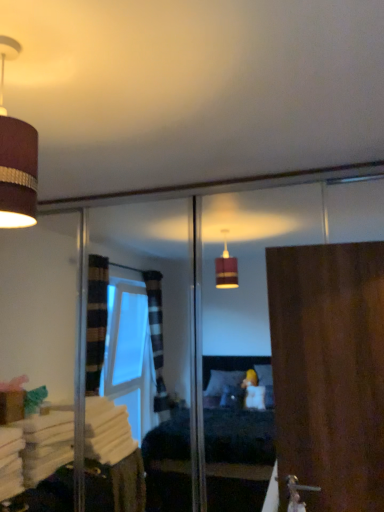
What do you see at coordinates (16, 158) in the screenshot? I see `matte brown lampshade at upper left` at bounding box center [16, 158].

Locate an element on the screen. matte brown lampshade at upper left is located at coordinates tap(16, 158).

What do you see at coordinates (329, 372) in the screenshot? I see `wooden door at right` at bounding box center [329, 372].

This screenshot has width=384, height=512. Find the location of `wooden door at right`. wooden door at right is located at coordinates (329, 372).

The width and height of the screenshot is (384, 512). Find the location of `matte brown lampshade at upper left`. matte brown lampshade at upper left is located at coordinates (16, 158).

Which object is positioned more to the left, matte brown lampshade at upper left or wooden door at right?

matte brown lampshade at upper left is more to the left.

Is matte brown lampshade at upper left in front of or behind wooden door at right in the image?

matte brown lampshade at upper left is positioned closer to the viewer than wooden door at right.

From the picture: Which point is more distant from viewer, (2, 164) or (373, 446)?

The point (373, 446) is farther.

From the image's perspective, between matte brown lampshade at upper left and wooden door at right, who is located below?

wooden door at right appears lower in the image.

From a real-world perspective, is matte brown lampshade at upper left physically located above or below wooden door at right?

In terms of real-world spatial position, matte brown lampshade at upper left is above wooden door at right.

Can you confirm if matte brown lampshade at upper left is thinner than wooden door at right?

No.

Is matte brown lampshade at upper left taller or shorter than wooden door at right?

In the image, matte brown lampshade at upper left appears to be shorter than wooden door at right.

Can you confirm if matte brown lampshade at upper left is smaller than wooden door at right?

Yes.

Based on the photo, is wooden door at right inside matte brown lampshade at upper left?

That's incorrect, wooden door at right is not inside matte brown lampshade at upper left.

Is matte brown lampshade at upper left not near wooden door at right?

Yes, matte brown lampshade at upper left and wooden door at right are located far from each other.

Is matte brown lampshade at upper left facing towards wooden door at right?

No, matte brown lampshade at upper left does not turn towards wooden door at right.

What's the angular difference between matte brown lampshade at upper left and wooden door at right's facing directions?

82.4 degrees.

Find the location of `door below the matte brown lampshade at upper left (from the image's perspective)`. door below the matte brown lampshade at upper left (from the image's perspective) is located at coordinates (329, 372).

Which is more to the left, wooden door at right or matte brown lampshade at upper left?

Positioned to the left is matte brown lampshade at upper left.

Does wooden door at right lie behind matte brown lampshade at upper left?

Yes, it is behind matte brown lampshade at upper left.

Is point (314, 411) in front of point (31, 210)?

No, (314, 411) is further to viewer.

From the image's perspective, which object appears higher, wooden door at right or matte brown lampshade at upper left?

From the image's view, matte brown lampshade at upper left is above.

From a real-world perspective, between wooden door at right and matte brown lampshade at upper left, who is vertically higher?

From a 3D spatial view, matte brown lampshade at upper left is above.

Which of these two, wooden door at right or matte brown lampshade at upper left, is thinner?

With smaller width is wooden door at right.

Is wooden door at right taller or shorter than matte brown lampshade at upper left?

In the image, wooden door at right appears to be taller than matte brown lampshade at upper left.

In terms of size, does wooden door at right appear bigger or smaller than matte brown lampshade at upper left?

Clearly, wooden door at right is larger in size than matte brown lampshade at upper left.

Would you say wooden door at right is outside matte brown lampshade at upper left?

Yes.

Is wooden door at right beside matte brown lampshade at upper left?

No, wooden door at right is not in contact with matte brown lampshade at upper left.

Could you tell me if wooden door at right is turned towards matte brown lampshade at upper left?

No, wooden door at right is not turned towards matte brown lampshade at upper left.

How many degrees apart are the facing directions of wooden door at right and matte brown lampshade at upper left?

82.4 degrees.

I want to click on lamp above the wooden door at right (from the image's perspective), so click(16, 158).

Where is `lamp that is above the wooden door at right (from a real-world perspective)`? This screenshot has width=384, height=512. lamp that is above the wooden door at right (from a real-world perspective) is located at coordinates (16, 158).

Identify the location of lamp lying above the wooden door at right (from the image's perspective). The image size is (384, 512). (16, 158).